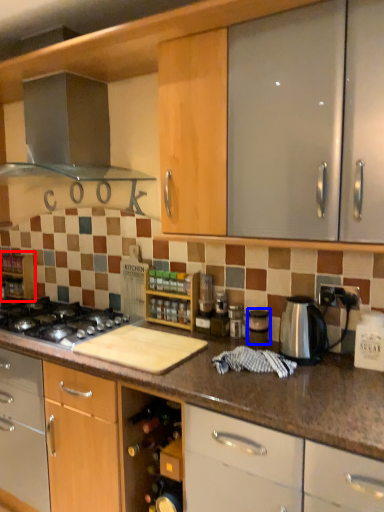
Question: Which object appears closest to the camera in this image, shelf (highlighted by a red box) or appliance (highlighted by a blue box)?

Choices:
 (A) shelf
 (B) appliance

Answer: (B)